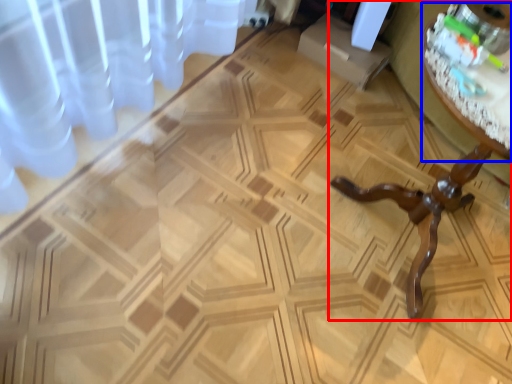
Question: Among these objects, which one is nearest to the camera, table (highlighted by a red box) or round table (highlighted by a blue box)?

Choices:
 (A) table
 (B) round table

Answer: (A)